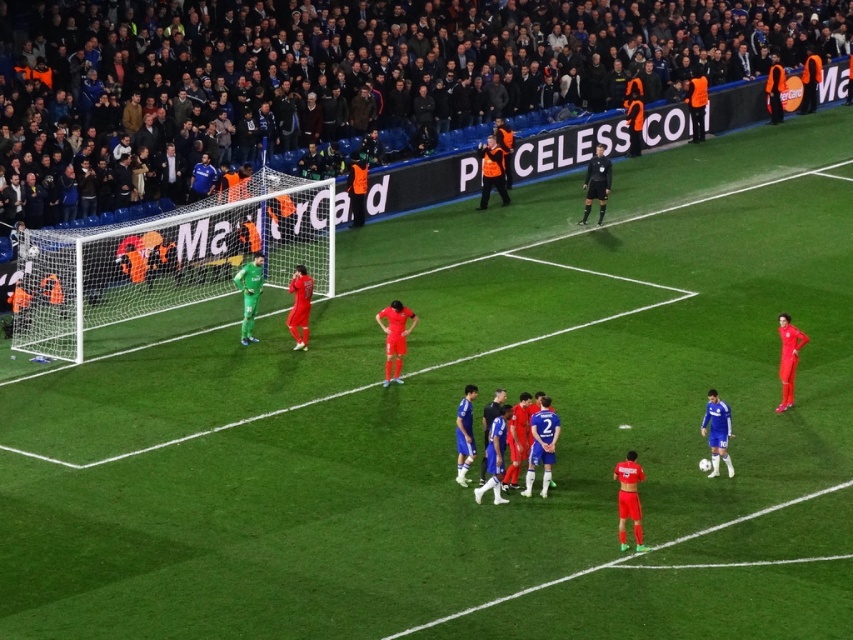
Is dark gray fabric crowd at upper center positioned in front of green net at left?

No, it is not.

Can you confirm if dark gray fabric crowd at upper center is positioned to the left of green net at left?

Incorrect, dark gray fabric crowd at upper center is not on the left side of green net at left.

Does point (228, 19) come in front of point (42, 241)?

No.

Where is `dark gray fabric crowd at upper center`? Image resolution: width=853 pixels, height=640 pixels. dark gray fabric crowd at upper center is located at coordinates (369, 64).

Does point (277, 196) come behind point (602, 182)?

No, it is in front of (602, 182).

Is point (256, 212) closer to camera compared to point (608, 170)?

Yes, it is.

Where is `green net at left`? green net at left is located at coordinates (169, 260).

Is dark gray fabric crowd at upper center smaller than black jersey at center?

No.

Between dark gray fabric crowd at upper center and black jersey at center, which one appears on the left side from the viewer's perspective?

From the viewer's perspective, dark gray fabric crowd at upper center appears more on the left side.

Is point (68, 154) farther from viewer compared to point (605, 170)?

No, it is not.

Find the location of a particular element. Image resolution: width=853 pixels, height=640 pixels. dark gray fabric crowd at upper center is located at coordinates (369, 64).